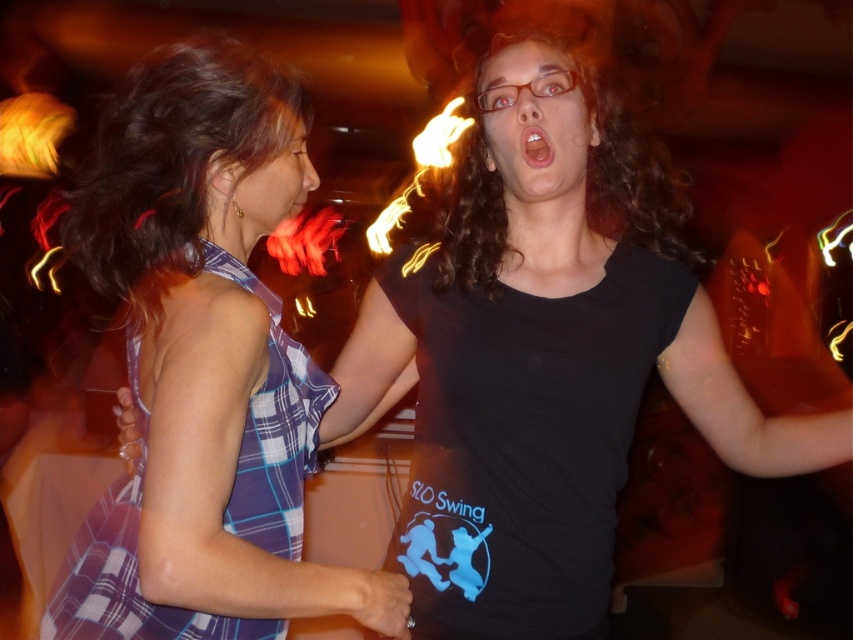
Can you confirm if black matte tank top at center is thinner than plaid fabric dress at left?

No, black matte tank top at center is not thinner than plaid fabric dress at left.

Can you confirm if black matte tank top at center is wider than plaid fabric dress at left?

Yes, black matte tank top at center is wider than plaid fabric dress at left.

From the picture: Who is more forward, (616, 369) or (126, 502)?

Point (126, 502) is in front.

Find the location of a particular element. black matte tank top at center is located at coordinates (524, 444).